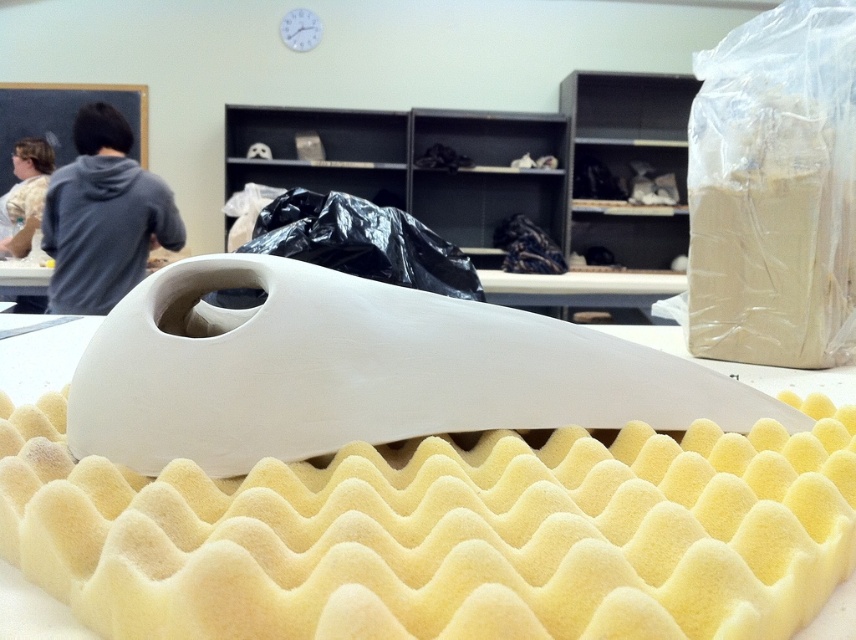
Question: Based on their relative distances, which object is nearer to the white cotton shirt at left?

Choices:
 (A) gray hoodie at upper left
 (B) white foam at center
 (C) black plastic bag at center

Answer: (A)

Question: Can you confirm if white foam at center is bigger than black plastic bag at center?

Choices:
 (A) no
 (B) yes

Answer: (A)

Question: Is black plastic bag at center to the right of white cotton shirt at left from the viewer's perspective?

Choices:
 (A) yes
 (B) no

Answer: (A)

Question: Among these objects, which one is nearest to the camera?

Choices:
 (A) white foam at center
 (B) gray hoodie at upper left

Answer: (A)

Question: Which object is closer to the camera taking this photo?

Choices:
 (A) white foam at center
 (B) black plastic bag at center

Answer: (A)

Question: Where is gray hoodie at upper left located in relation to black plastic bag at center in the image?

Choices:
 (A) left
 (B) right

Answer: (A)